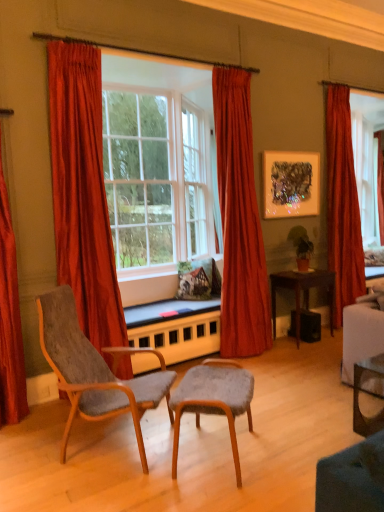
Question: Considering their positions, is velvet red curtain at center, placed as the second curtain when sorted from right to left, located in front of or behind satin red curtain at left, which ranks as the 1th curtain in left-to-right order?

Choices:
 (A) behind
 (B) front

Answer: (A)

Question: Which is correct: velvet red curtain at center, placed as the second curtain when sorted from right to left, is inside satin red curtain at left, which ranks as the 1th curtain in left-to-right order, or outside of it?

Choices:
 (A) outside
 (B) inside

Answer: (A)

Question: Estimate the real-world distances between objects in this image. Which object is closer to the metallic textured artwork at upper right?

Choices:
 (A) velvet grey stool at center, arranged as the second chair when viewed from the left
 (B) satin red curtain at left, the fourth curtain when ordered from right to left
 (C) clear glass window at center
 (D) wooden desk at lower right, the 2th desk positioned from the front
 (E) green matte houseplant at upper right

Answer: (E)

Question: Which of these objects is positioned closest to the velvet red curtain at left, the second curtain viewed from the left?

Choices:
 (A) green matte houseplant at upper right
 (B) wooden desk at lower right, which is the first desk in back-to-front order
 (C) clear glass desk at lower right, the 2th desk viewed from the back
 (D) satin red curtain at left, the fourth curtain when ordered from right to left
 (E) metallic textured artwork at upper right

Answer: (D)